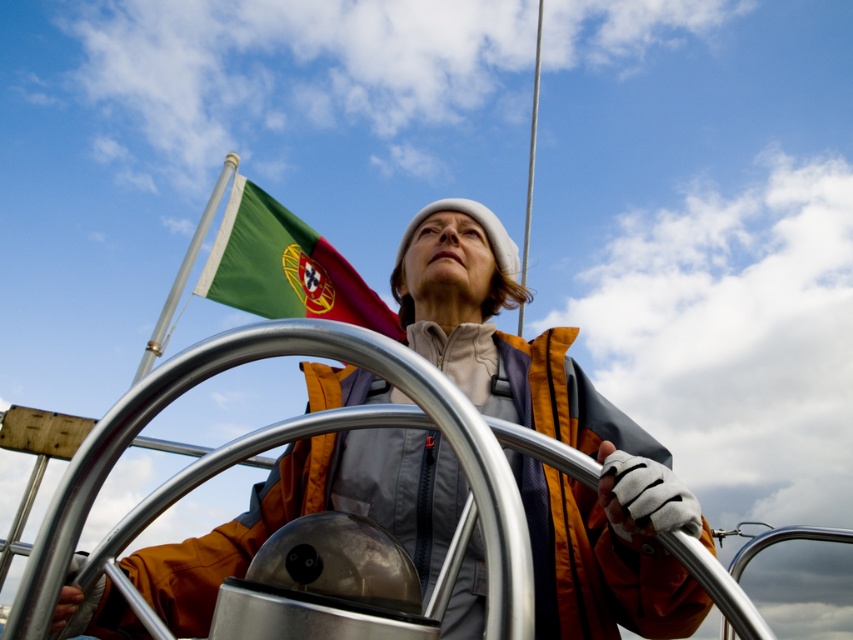
You are a passenger on the boat and want to locate the captain. The captain is wearing an orange fabric jacket at center and is near the green fabric flag at upper left. Based on their positions, which object is closer to the right side of the image?

The orange fabric jacket at center is closer to the right side of the image because it is positioned to the right of the green fabric flag at upper left.

You are a passenger on the boat and want to take a photo of the green fabric flag at upper left without the orange fabric jacket at center blocking it. How can you adjust your position to achieve this?

The orange fabric jacket at center is in front of the green fabric flag at upper left. To avoid the jacket blocking the flag, move to a position where the jacket is no longer between you and the flag, such as moving sideways or backward to get a clear view of the green fabric flag at upper left.